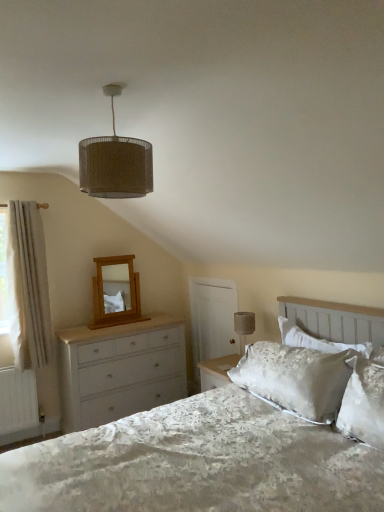
You are a GUI agent. You are given a task and a screenshot of the screen. Output one action in this format:
    pyautogui.click(x=<x>, y=<y>)
    Task: Click on the matte gray fabric at upper right
    The image size is (384, 512).
    Given the screenshot: What is the action you would take?
    pyautogui.click(x=244, y=323)

In order to face white painted wood chest of drawers at left, should I rotate leftwards or rightwards?

Rotate your view left by about 8.937°.

What do you see at coordinates (28, 286) in the screenshot? This screenshot has height=512, width=384. I see `white fluffy curtain at left` at bounding box center [28, 286].

This screenshot has height=512, width=384. I want to click on white wooden screen door at center, so click(213, 318).

Measure the distance between burlap lampshade at upper center and camera.

The distance of burlap lampshade at upper center from camera is 1.63 meters.

Where is `light oak wooden mirror at upper left`? The image size is (384, 512). light oak wooden mirror at upper left is located at coordinates (115, 292).

Is white fluffy curtain at left situated inside burlap lampshade at upper center or outside?

white fluffy curtain at left exists outside the volume of burlap lampshade at upper center.

Considering their positions, is white fluffy curtain at left located in front of or behind burlap lampshade at upper center?

Visually, white fluffy curtain at left is located behind burlap lampshade at upper center.

Could you tell me if white fluffy curtain at left is turned towards burlap lampshade at upper center?

Yes, white fluffy curtain at left is turned towards burlap lampshade at upper center.

Which of these two, white painted wood chest of drawers at left or white fluffy curtain at left, is wider?

white painted wood chest of drawers at left.

Is white painted wood chest of drawers at left oriented away from white fluffy curtain at left?

No.

Where is `chest of drawers below the white fluffy curtain at left (from the image's perspective)`? Image resolution: width=384 pixels, height=512 pixels. chest of drawers below the white fluffy curtain at left (from the image's perspective) is located at coordinates (119, 370).

Is silky white pillow at upper right not close to light oak wooden mirror at upper left?

silky white pillow at upper right is far away from light oak wooden mirror at upper left.

From a real-world perspective, which is physically below, silky white pillow at upper right or light oak wooden mirror at upper left?

silky white pillow at upper right.

Looking at this image, relative to light oak wooden mirror at upper left, is silky white pillow at upper right in front or behind?

Visually, silky white pillow at upper right is located in front of light oak wooden mirror at upper left.

Is light oak wooden mirror at upper left inside silky white pillow at upper right?

That's incorrect, light oak wooden mirror at upper left is not inside silky white pillow at upper right.

Considering the sizes of objects white wooden screen door at center and white satin bed at center in the image provided, who is wider, white wooden screen door at center or white satin bed at center?

white satin bed at center is wider.

Choose the correct answer: Is white wooden screen door at center inside white satin bed at center or outside it?

white wooden screen door at center is not enclosed by white satin bed at center.

From a real-world perspective, is white wooden screen door at center positioned above or below white satin bed at center?

Clearly, from a real-world perspective, white wooden screen door at center is above white satin bed at center.

Which object is positioned more to the left, white wooden screen door at center or white satin bed at center?

white wooden screen door at center.

Does white wooden screen door at center lie behind burlap lampshade at upper center?

Yes, white wooden screen door at center is further from the viewer.

Between white wooden screen door at center and burlap lampshade at upper center, which one has larger size?

With larger size is white wooden screen door at center.

From the image's perspective, which is above, white wooden screen door at center or burlap lampshade at upper center?

burlap lampshade at upper center, from the image's perspective.

Between burlap lampshade at upper center and white satin bed at center, which one has more height?

white satin bed at center is taller.

Is burlap lampshade at upper center positioned in front of white satin bed at center?

That is False.

From the image's perspective, which is above, burlap lampshade at upper center or white satin bed at center?

burlap lampshade at upper center is shown above in the image.

From a real-world perspective, is burlap lampshade at upper center located higher than white satin bed at center?

Correct, in the physical world, burlap lampshade at upper center is higher than white satin bed at center.

Considering the sizes of silky white pillow at upper right and white wooden screen door at center in the image, is silky white pillow at upper right taller or shorter than white wooden screen door at center?

silky white pillow at upper right is shorter than white wooden screen door at center.

Would you consider silky white pillow at upper right to be distant from white wooden screen door at center?

Yes, silky white pillow at upper right is far from white wooden screen door at center.

Is silky white pillow at upper right closer to the viewer compared to white wooden screen door at center?

Yes, the depth of silky white pillow at upper right is less than that of white wooden screen door at center.

In order to click on curtain below the burlap lampshade at upper center (from a real-world perspective) in this screenshot , I will do `click(28, 286)`.

Locate an element on the screen. chest of drawers on the right side of white fluffy curtain at left is located at coordinates (119, 370).

From the image, which object appears to be farther from white wooden screen door at center, light oak wooden mirror at upper left or silky white pillow at upper right?

silky white pillow at upper right lies further to white wooden screen door at center than the other object.

Estimate the real-world distances between objects in this image. Which object is further from white painted wood chest of drawers at left, matte gray fabric at upper right or white satin bed at center?

white satin bed at center is further to white painted wood chest of drawers at left.

When comparing their distances from matte gray fabric at upper right, does white satin bed at center or white painted wood chest of drawers at left seem further?

white satin bed at center is further to matte gray fabric at upper right.

Looking at the image, which one is located closer to white satin bed at center, burlap lampshade at upper center or silky white pillow at upper right?

Among the two, silky white pillow at upper right is located nearer to white satin bed at center.

From the image, which object appears to be nearer to white wooden screen door at center, matte gray fabric at upper right or white painted wood chest of drawers at left?

The object closer to white wooden screen door at center is matte gray fabric at upper right.

Considering their positions, is white painted wood chest of drawers at left positioned closer to silky white pillow at upper right than burlap lampshade at upper center?

Based on the image, burlap lampshade at upper center appears to be nearer to silky white pillow at upper right.

Looking at this image, looking at the image, which one is located further to white wooden screen door at center, white painted wood chest of drawers at left or light oak wooden mirror at upper left?

light oak wooden mirror at upper left is positioned further to the anchor white wooden screen door at center.

When comparing their distances from white painted wood chest of drawers at left, does silky white pillow at upper right or white wooden screen door at center seem further?

Among the two, silky white pillow at upper right is located further to white painted wood chest of drawers at left.

This screenshot has height=512, width=384. What are the coordinates of `lamp between white satin bed at center and matte gray fabric at upper right along the z-axis` in the screenshot? It's located at (115, 162).

At what (x,y) coordinates should I click in order to perform the action: click on pillow between white satin bed at center and light oak wooden mirror at upper left from front to back. Please return your answer as a coordinate pair (x, y). The height and width of the screenshot is (512, 384). Looking at the image, I should click on (316, 340).

I want to click on pillow positioned between burlap lampshade at upper center and matte gray fabric at upper right from near to far, so click(316, 340).

This screenshot has height=512, width=384. Identify the location of screen door between white painted wood chest of drawers at left and silky white pillow at upper right. (213, 318).